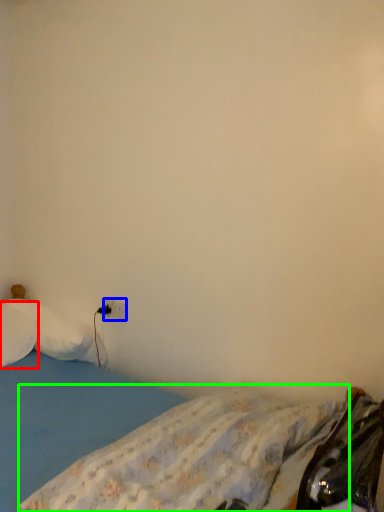
Question: Estimate the real-world distances between objects in this image. Which object is closer to pillow (highlighted by a red box), electric outlet (highlighted by a blue box) or mattress (highlighted by a green box)?

Choices:
 (A) electric outlet
 (B) mattress

Answer: (A)